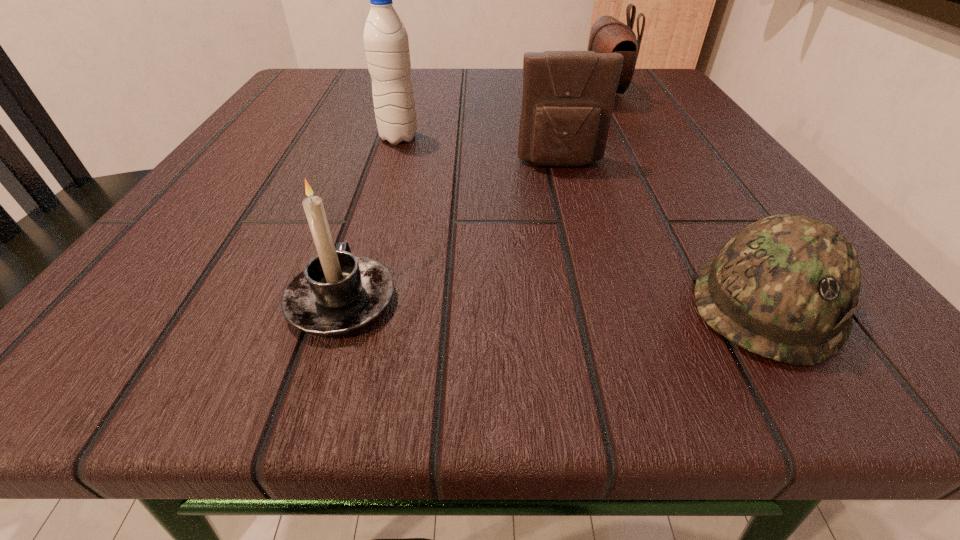
At what (x,y) coordinates should I click in order to perform the action: click on pouch located in the right edge section of the desktop. Please return your answer as a coordinate pair (x, y). The image size is (960, 540). Looking at the image, I should click on (608, 35).

The height and width of the screenshot is (540, 960). Find the location of `headwear present at the right edge`. headwear present at the right edge is located at coordinates (785, 287).

The width and height of the screenshot is (960, 540). I want to click on object that is at the far right corner, so click(608, 35).

Identify the location of object that is at the near right corner. This screenshot has height=540, width=960. (785, 287).

In the image, there is a desktop. At what (x,y) coordinates should I click in order to perform the action: click on vacant area at the far edge. Please return your answer as a coordinate pair (x, y). Image resolution: width=960 pixels, height=540 pixels. Looking at the image, I should click on (470, 78).

In the image, there is a desktop. Identify the location of free space at the left edge. This screenshot has width=960, height=540. (293, 176).

Locate an element on the screen. free location at the right edge is located at coordinates tap(667, 130).

In the image, there is a desktop. At what (x,y) coordinates should I click in order to perform the action: click on free space at the far left corner. Please return your answer as a coordinate pair (x, y). The height and width of the screenshot is (540, 960). Looking at the image, I should click on (328, 93).

Identify the location of free space at the near left corner of the desktop. This screenshot has height=540, width=960. (92, 341).

In the image, there is a desktop. Where is `blank space at the far right corner`? blank space at the far right corner is located at coordinates (x=660, y=71).